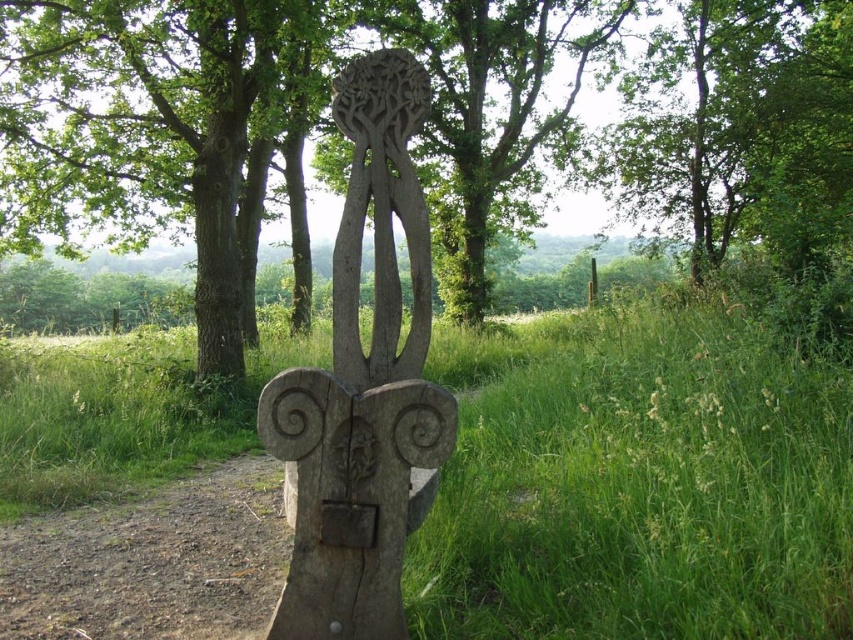
You are a gardener trying to plant a new flower in the green grass at center and the brown rough tree trunk at center. Which area would allow for a wider planting space?

The green grass at center has a greater width than the brown rough tree trunk at center, so the green grass at center provides a wider planting space for the new flower.

You are standing in the outdoor scene and see the green grass at center and the smooth brown tree trunk at center. Which object is positioned more to the right side?

The green grass at center is positioned to the right of the smooth brown tree trunk at center, so the green grass at center is more to the right side.

You are a gardener who wants to plant a new flower bed between the green grass at center and the brown rough tree trunk at center. Which object should you place the flowers closer to if you want them to be visible from a distance?

The flowers should be placed closer to the green grass at center because it is shorter than the brown rough tree trunk at center, making them more visible above the grass.